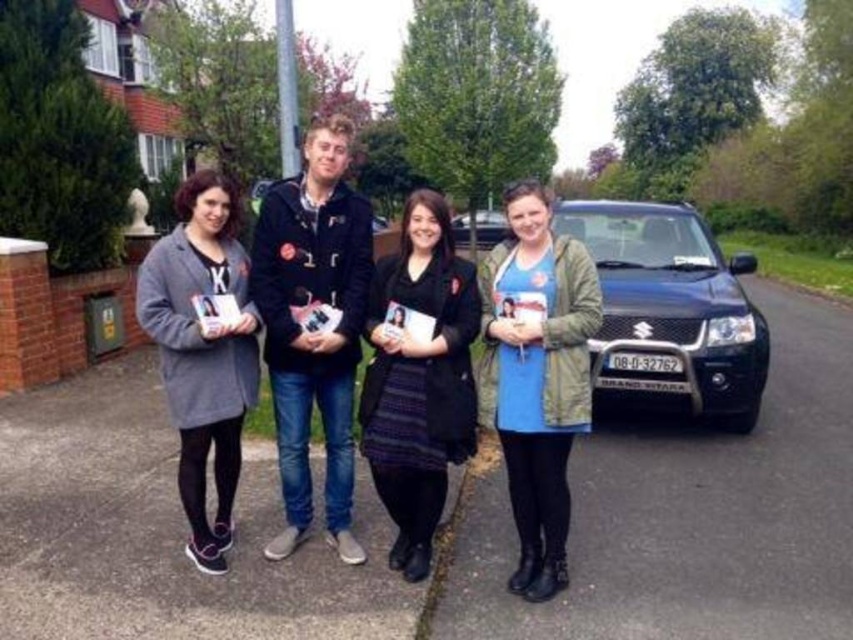
Question: Can you confirm if black matte suv at right is positioned below metallic pole at upper center?

Choices:
 (A) no
 (B) yes

Answer: (B)

Question: Which object is the closest to the black matte suv at right?

Choices:
 (A) blue matte dress at center
 (B) matte black jacket at center
 (C) metallic pole at upper center
 (D) dark purple textured dress at center

Answer: (A)

Question: Which point appears farthest from the camera in this image?

Choices:
 (A) (506, 353)
 (B) (637, 371)
 (C) (288, 22)
 (D) (375, 349)

Answer: (C)

Question: Which is nearer to the metallic pole at upper center?

Choices:
 (A) black matte suv at right
 (B) dark purple textured dress at center

Answer: (B)

Question: Does matte black jacket at center appear on the left side of dark purple textured dress at center?

Choices:
 (A) no
 (B) yes

Answer: (B)

Question: Observing the image, what is the correct spatial positioning of dark purple textured dress at center in reference to metallic pole at upper center?

Choices:
 (A) below
 (B) above

Answer: (A)